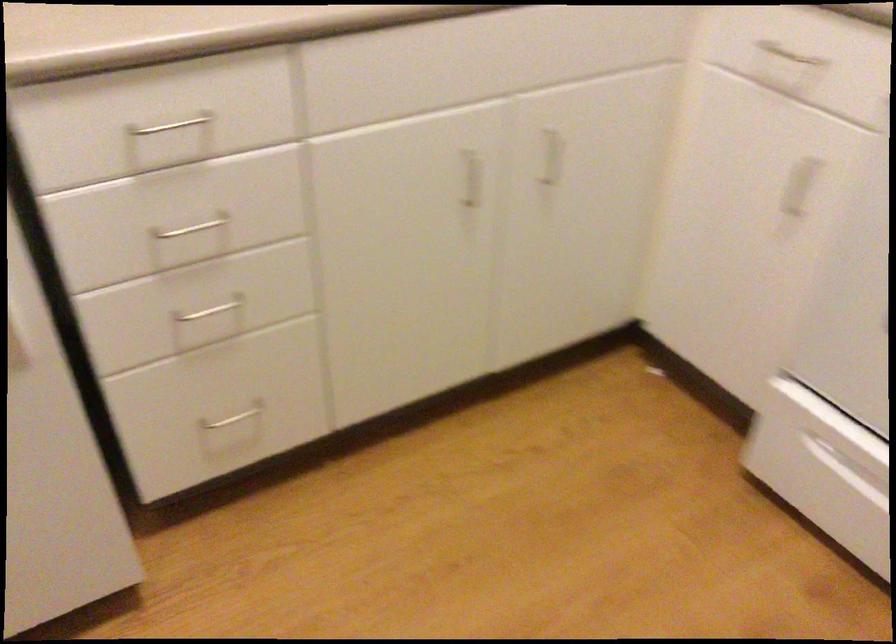
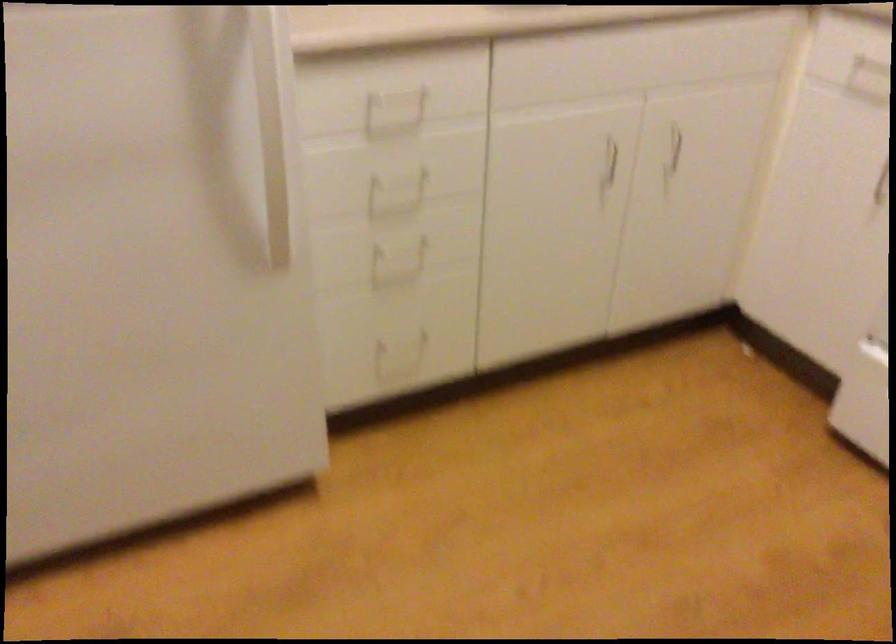
Find the pixel in the second image that matches point 238,413 in the first image.

(401, 345)